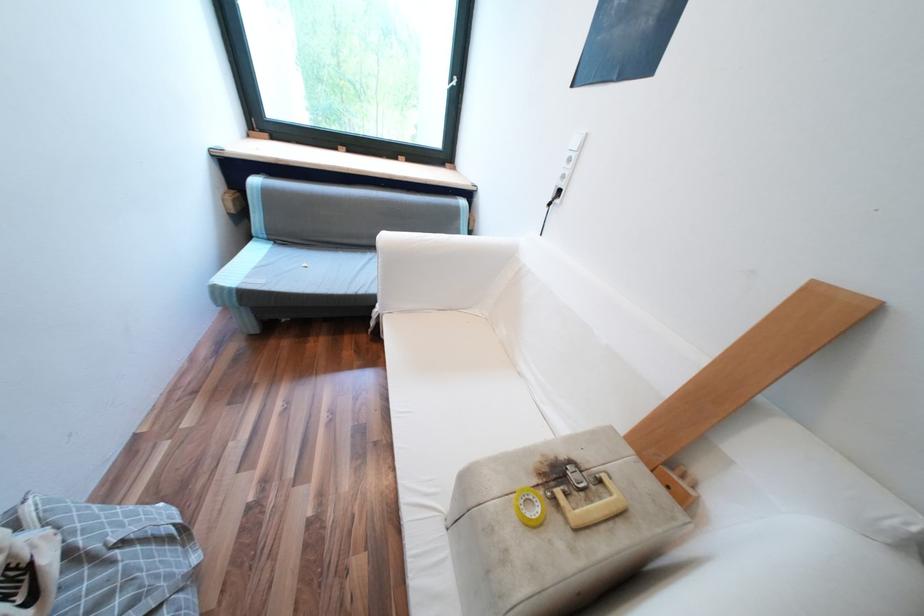
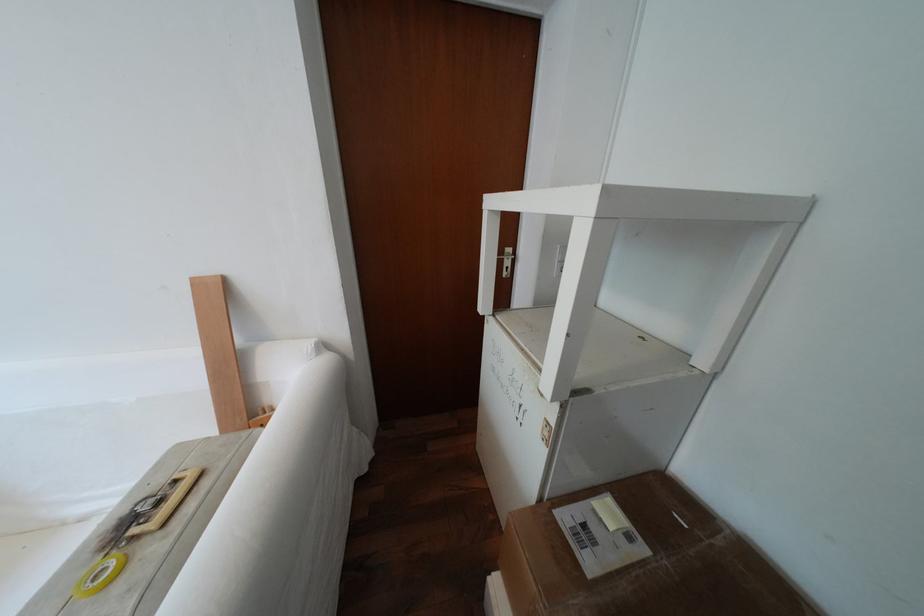
How did the camera likely rotate?

The camera rotated toward right-down.